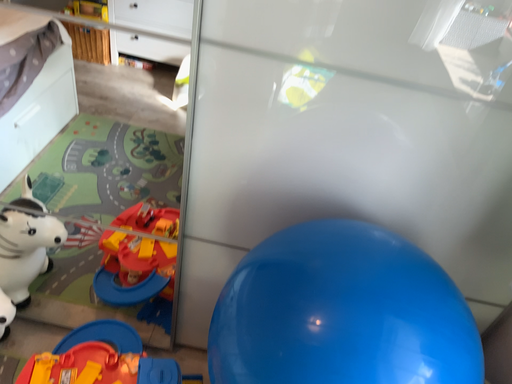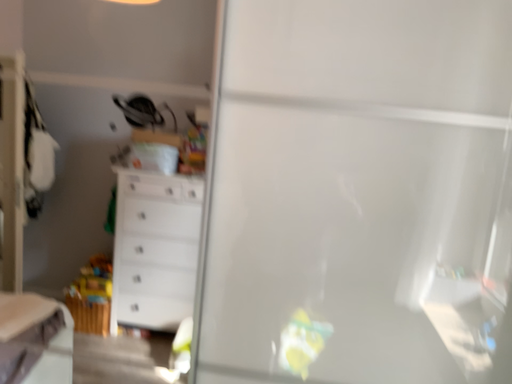
Question: How did the camera likely rotate when shooting the video?

Choices:
 (A) rotated upward
 (B) rotated downward

Answer: (A)